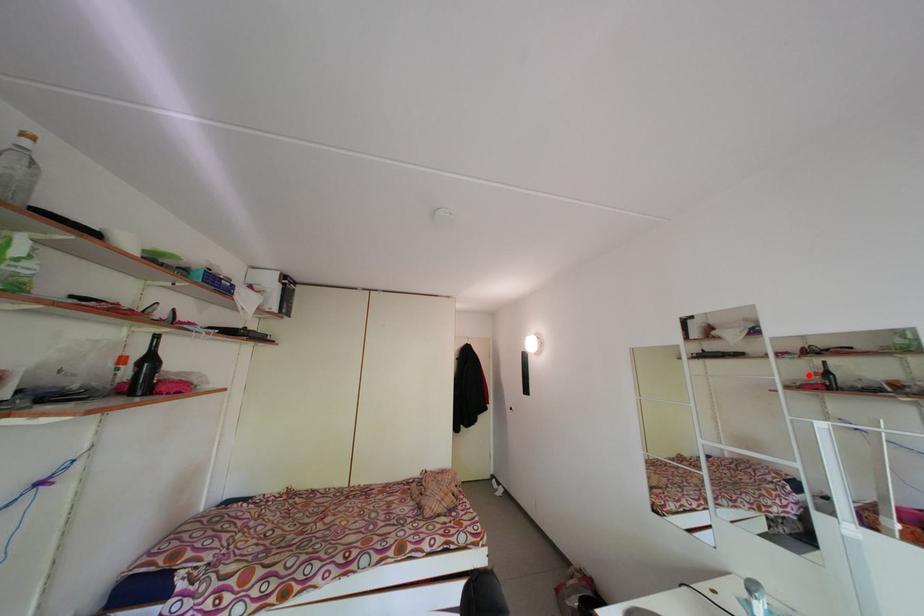
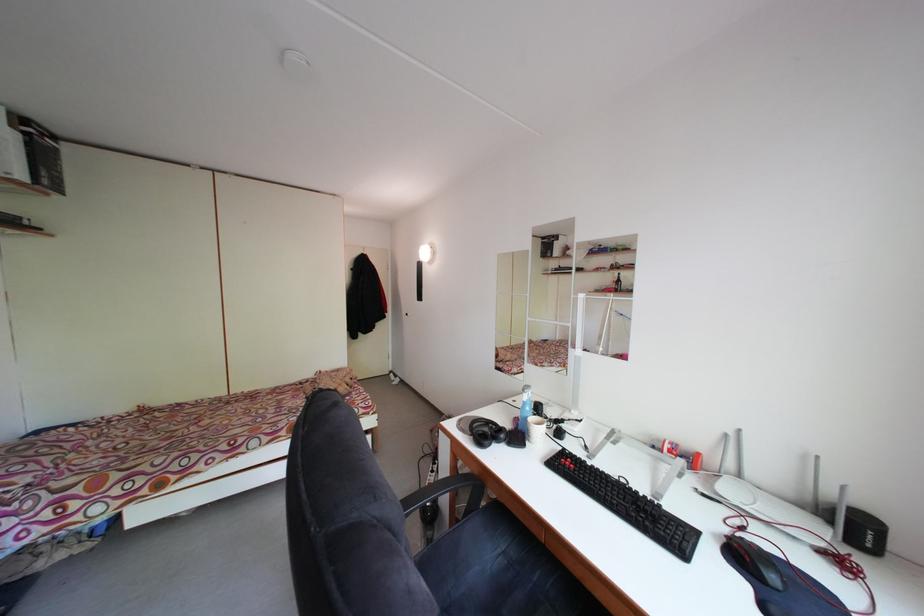
Question: I am providing you with two images of the same scene from different viewpoints. Given a red point in image1, look at the same physical point in image2. Is it:

Choices:
 (A) Closer to the viewpoint
 (B) Farther from the viewpoint

Answer: (A)